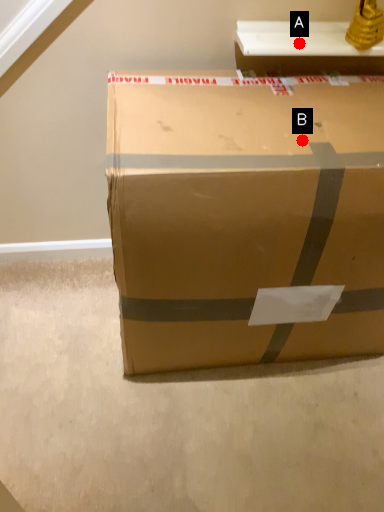
Question: Two points are circled on the image, labeled by A and B beside each circle. Which point is closer to the camera taking this photo?

Choices:
 (A) A is closer
 (B) B is closer

Answer: (B)